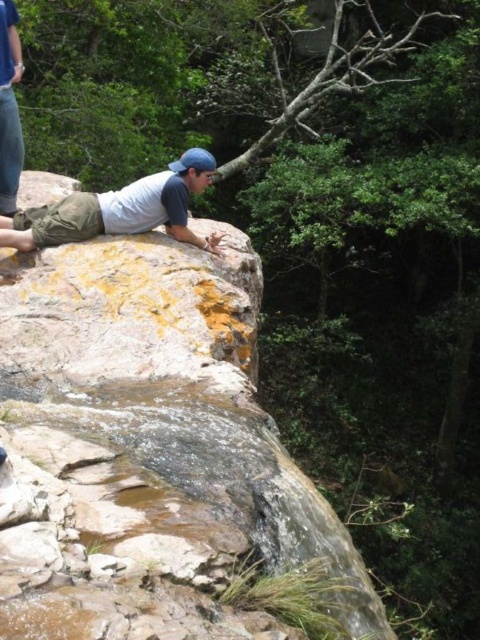
Question: Which of the following is the closest to the observer?

Choices:
 (A) matte gray shirt at center
 (B) matte gray shirt at upper left

Answer: (A)

Question: Does matte gray shirt at center appear under matte gray shirt at upper left?

Choices:
 (A) yes
 (B) no

Answer: (A)

Question: Is matte gray shirt at center bigger than matte gray shirt at upper left?

Choices:
 (A) no
 (B) yes

Answer: (B)

Question: Which point appears farthest from the camera in this image?

Choices:
 (A) (205, 248)
 (B) (11, 99)

Answer: (A)

Question: Is matte gray shirt at center smaller than matte gray shirt at upper left?

Choices:
 (A) yes
 (B) no

Answer: (B)